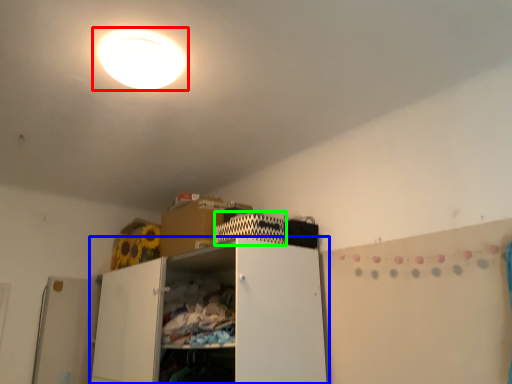
Question: Estimate the real-world distances between objects in this image. Which object is farther from lamp (highlighted by a red box), cabinetry (highlighted by a blue box) or cabinet (highlighted by a green box)?

Choices:
 (A) cabinetry
 (B) cabinet

Answer: (A)